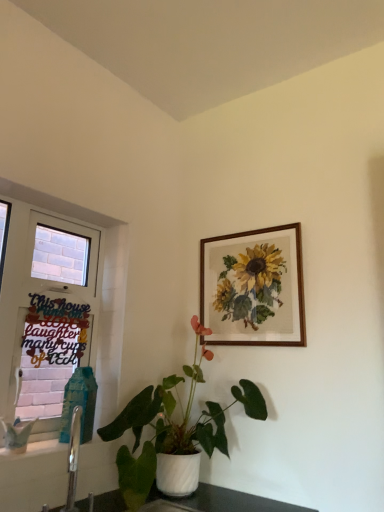
What do you see at coordinates (50, 353) in the screenshot?
I see `black paper sign at left` at bounding box center [50, 353].

This screenshot has height=512, width=384. I want to click on white painted wood window at left, so click(x=46, y=310).

What's the angular difference between wooden frame at upper right and white painted wood window at left's facing directions?

88.8 degrees separate the facing orientations of wooden frame at upper right and white painted wood window at left.

From a real-world perspective, is wooden frame at upper right on top of white painted wood window at left?

Yes, from a real-world perspective, wooden frame at upper right is over white painted wood window at left

From the image's perspective, which is above, wooden frame at upper right or white painted wood window at left?

wooden frame at upper right is shown above in the image.

Would you say wooden frame at upper right is a long distance from white painted wood window at left?

wooden frame at upper right is actually quite close to white painted wood window at left.

Is white glossy pot at center aimed at wooden frame at upper right?

No, white glossy pot at center is not aimed at wooden frame at upper right.

Choose the correct answer: Is white glossy pot at center inside wooden frame at upper right or outside it?

white glossy pot at center is spatially situated outside wooden frame at upper right.

Which point is more forward, (x=221, y=411) or (x=279, y=282)?

The point (x=279, y=282) is closer to the camera.

Which object is wider, white glossy pot at center or wooden frame at upper right?

white glossy pot at center.

Is wooden frame at upper right not within white glossy pot at center?

That's correct, wooden frame at upper right is outside of white glossy pot at center.

Looking at this image, considering their positions, is wooden frame at upper right located in front of or behind white glossy pot at center?

Clearly, wooden frame at upper right is behind white glossy pot at center.

Is white painted wood window at left directly adjacent to wooden frame at upper right?

No, white painted wood window at left is not beside wooden frame at upper right.

Considering the sizes of white painted wood window at left and wooden frame at upper right in the image, is white painted wood window at left wider or thinner than wooden frame at upper right?

Clearly, white painted wood window at left has more width compared to wooden frame at upper right.

From the image's perspective, which object appears higher, white painted wood window at left or wooden frame at upper right?

wooden frame at upper right, from the image's perspective.

From the image's perspective, which one is positioned lower, white painted wood window at left or black paper sign at left?

black paper sign at left appears lower in the image.

Considering the positions of point (60, 247) and point (34, 349), is point (60, 247) closer or farther from the camera than point (34, 349)?

Point (60, 247).

From the picture: Considering the sizes of objects white painted wood window at left and black paper sign at left in the image provided, who is taller, white painted wood window at left or black paper sign at left?

white painted wood window at left is taller.

What's the angular difference between white painted wood window at left and black paper sign at left's facing directions?

There is a 1.9-degree angle between the facing directions of white painted wood window at left and black paper sign at left.

Looking at this image, can you see white glossy pot at center touching white painted wood window at left?

No, white glossy pot at center is not next to white painted wood window at left.

Which of these two, white glossy pot at center or white painted wood window at left, is bigger?

white glossy pot at center.

Which is behind, point (130, 477) or point (78, 289)?

Positioned behind is point (78, 289).

From the image's perspective, which is below, white glossy pot at center or white painted wood window at left?

white glossy pot at center.

Which of these two, white painted wood window at left or white glossy pot at center, is thinner?

Thinner between the two is white painted wood window at left.

Which point is more distant from viewer, (26, 365) or (188, 422)?

The point (188, 422) is behind.

Is white painted wood window at left positioned with its back to white glossy pot at center?

No.

The image size is (384, 512). What are the coordinates of `picture frame lying on the right of white painted wood window at left` in the screenshot? It's located at (253, 288).

At what (x,y) coordinates should I click in order to perform the action: click on houseplant that is under the wooden frame at upper right (from a real-world perspective). Please return your answer as a coordinate pair (x, y). This screenshot has height=512, width=384. Looking at the image, I should click on (174, 432).

Looking at the image, which one is located further to white glossy pot at center, black paper sign at left or wooden frame at upper right?

The object further to white glossy pot at center is black paper sign at left.

Looking at the image, which one is located closer to white glossy pot at center, white painted wood window at left or black paper sign at left?

Based on the image, white painted wood window at left appears to be nearer to white glossy pot at center.

In the scene shown: Based on their spatial positions, is black paper sign at left or white glossy pot at center closer to wooden frame at upper right?

Among the two, white glossy pot at center is located nearer to wooden frame at upper right.

Considering their positions, is white glossy pot at center positioned further to white painted wood window at left than wooden frame at upper right?

Based on the image, wooden frame at upper right appears to be further to white painted wood window at left.

From the image, which object appears to be farther from black paper sign at left, wooden frame at upper right or white glossy pot at center?

wooden frame at upper right is further to black paper sign at left.

From the image, which object appears to be nearer to wooden frame at upper right, white painted wood window at left or white glossy pot at center?

Based on the image, white glossy pot at center appears to be nearer to wooden frame at upper right.

From the image, which object appears to be farther from black paper sign at left, white glossy pot at center or wooden frame at upper right?

wooden frame at upper right lies further to black paper sign at left than the other object.

Looking at this image, when comparing their distances from white painted wood window at left, does black paper sign at left or wooden frame at upper right seem further?

black paper sign at left.

The height and width of the screenshot is (512, 384). I want to click on houseplant situated between white painted wood window at left and wooden frame at upper right from left to right, so click(x=174, y=432).

Identify the location of window screen between white painted wood window at left and white glossy pot at center in the horizontal direction. The width and height of the screenshot is (384, 512). (50, 353).

Find the location of a particular element. houseplant between black paper sign at left and wooden frame at upper right from left to right is located at coordinates (174, 432).

I want to click on window screen located between white painted wood window at left and wooden frame at upper right in the left-right direction, so click(x=50, y=353).